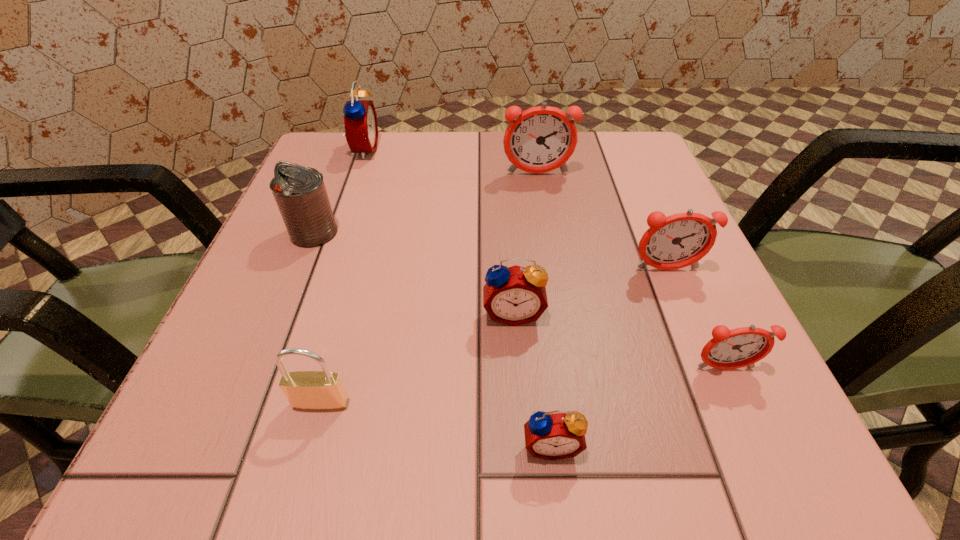
Find the location of a particular element. This screenshot has width=960, height=540. vacant point located between the nearest alarm clock and the can is located at coordinates (432, 339).

Where is `unoccupied area between the can and the second smallest red alarm clock`? The width and height of the screenshot is (960, 540). unoccupied area between the can and the second smallest red alarm clock is located at coordinates point(414,273).

Identify the location of vacant space in between the second nearest red alarm clock and the sixth nearest object. The width and height of the screenshot is (960, 540). (414, 273).

The height and width of the screenshot is (540, 960). In order to click on free area in between the sixth farthest object and the farthest alarm clock in this screenshot , I will do pos(543,259).

Find the location of a particular element. free area in between the fourth farthest alarm clock and the brass padlock is located at coordinates (417, 358).

Locate an element on the screen. free space between the third nearest object and the third nearest alarm clock is located at coordinates (618, 341).

Choose which object is the seventh nearest neighbor to the fourth nearest alarm clock. Please provide its 2D coordinates. Your answer should be formatted as a tuple, i.e. [(x, y)], where the tuple contains the x and y coordinates of a point satisfying the conditions above.

[(360, 118)]

Locate an element on the screen. Image resolution: width=960 pixels, height=540 pixels. object that ranks as the third closest to the nearest object is located at coordinates (323, 390).

Identify which alarm clock is the fifth closest to the smallest red alarm clock. Please provide its 2D coordinates. Your answer should be formatted as a tuple, i.e. [(x, y)], where the tuple contains the x and y coordinates of a point satisfying the conditions above.

[(360, 118)]

Find the location of a particular element. This screenshot has width=960, height=540. the third closest alarm clock to the farthest alarm clock is located at coordinates (680, 240).